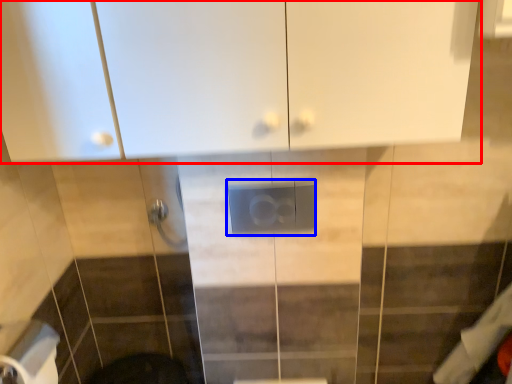
Question: Which of the following is the farthest to the observer, cabinetry (highlighted by a red box) or electric outlet (highlighted by a blue box)?

Choices:
 (A) cabinetry
 (B) electric outlet

Answer: (B)